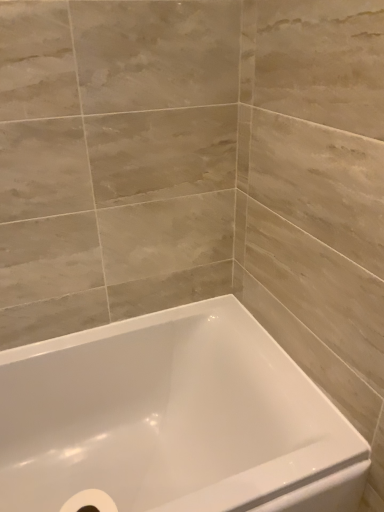
Describe the element at coordinates (173, 419) in the screenshot. I see `white glossy bathtub at center` at that location.

At what (x,y) coordinates should I click in order to perform the action: click on white glossy bathtub at center. Please return your answer as a coordinate pair (x, y). This screenshot has height=512, width=384. Looking at the image, I should click on (173, 419).

At what (x,y) coordinates should I click in order to perform the action: click on white glossy bathtub at center. Please return your answer as a coordinate pair (x, y). Looking at the image, I should click on (173, 419).